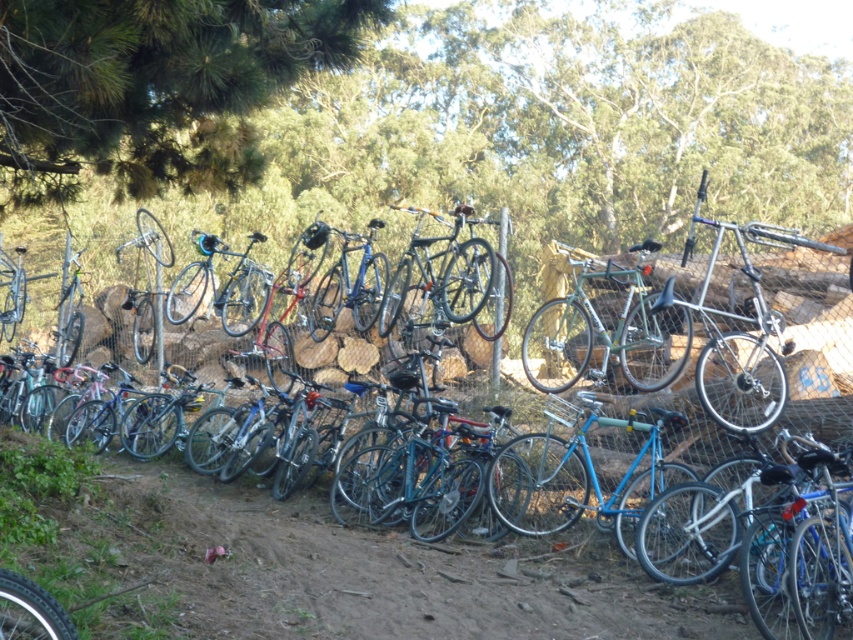
Question: Considering the real-world distances, which object is farthest from the shiny silver bicycle at center?

Choices:
 (A) green leafy tree at upper left
 (B) green matte bicycle at center

Answer: (A)

Question: Which point is farther to the camera?

Choices:
 (A) shiny silver bicycle at center
 (B) green matte bicycle at center
 (C) green leafy tree at upper left

Answer: (C)

Question: In this image, where is shiny silver bicycle at center located relative to green leafy tree at upper left?

Choices:
 (A) above
 (B) below

Answer: (B)

Question: Where is shiny silver bicycle at center located in relation to green matte bicycle at center in the image?

Choices:
 (A) right
 (B) left

Answer: (B)

Question: Can you confirm if green leafy tree at upper left is bigger than green matte bicycle at center?

Choices:
 (A) no
 (B) yes

Answer: (A)

Question: Which of the following is the closest to the observer?

Choices:
 (A) (686, 323)
 (B) (550, 632)
 (C) (254, 81)

Answer: (B)